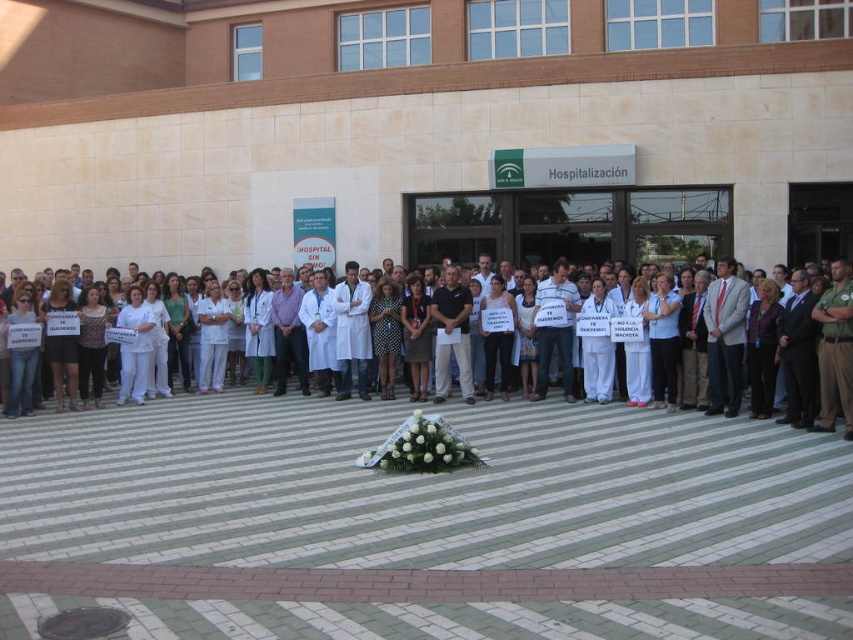
You are a photographer trying to capture a clear shot of the white lab coats at center. The camera you are using has a focus point at coordinate point (265, 413). Will this focus point help you capture the white lab coats at center?

Yes, the focus point at (265, 413) marks the location of the white lab coats at center, so using this point will ensure the white lab coats at center are in focus.

You are a photographer standing in front of the Hospital sin... sign. You need to capture a photo that includes both the white lab coats at center and the brown uniform at right. Which object should be placed closer to the camera to ensure both are visible in the frame?

To ensure both the white lab coats at center and the brown uniform at right are visible in the frame, the brown uniform at right should be placed closer to the camera since the white lab coats at center is positioned under it, meaning it is farther back.

You are a photographer trying to capture the entire group of protesters holding signs. You notice the white lab coats at center and the brown uniform at right in your frame. Which group should you move closer to in order to ensure both are visible without overlapping?

The white lab coats at center is in front of the brown uniform at right, so you should move closer to the brown uniform at right to ensure both are visible without overlapping.